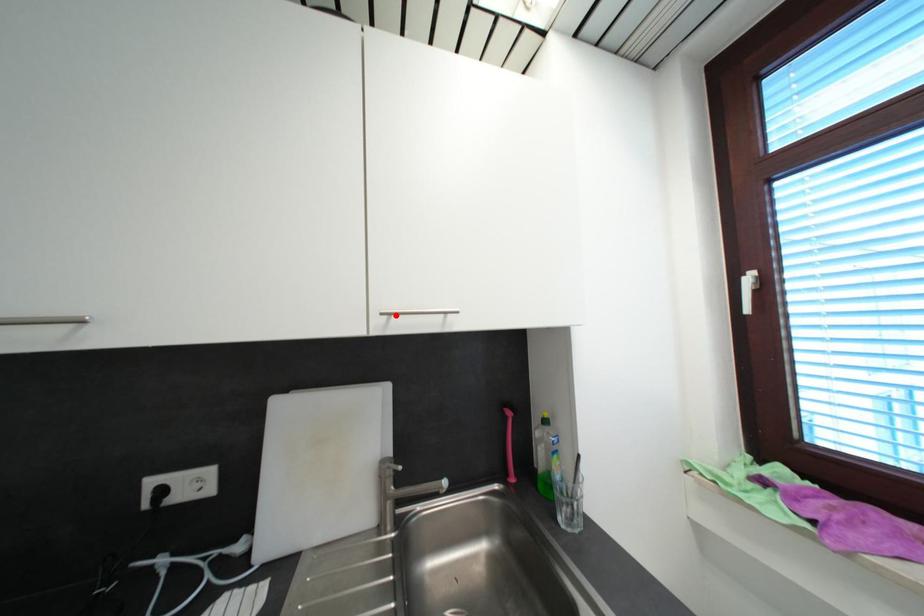
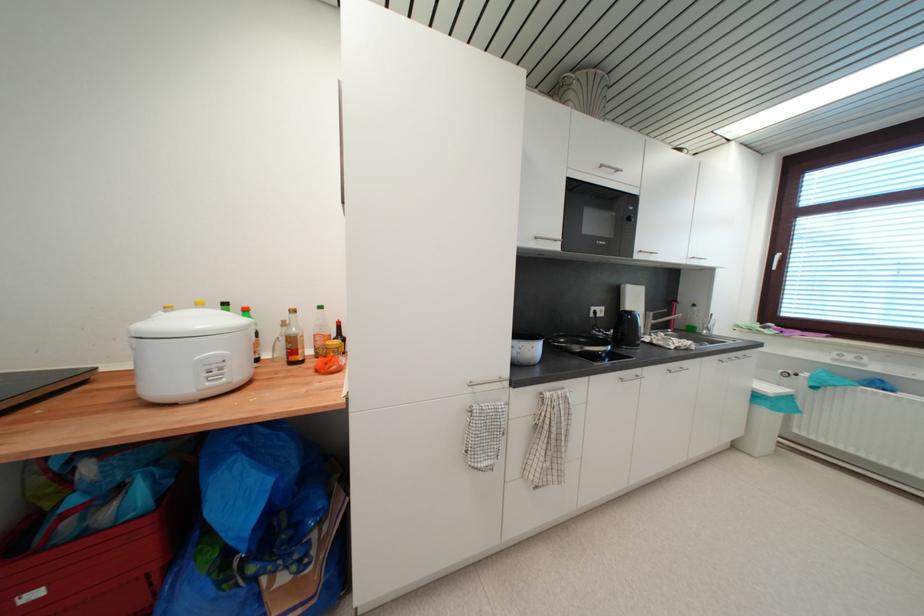
Question: I am providing you with two images of the same scene from different viewpoints. A red point is shown in image1. For the corresponding object point in image2, is it positioned nearer or farther from the camera?

Choices:
 (A) Nearer
 (B) Farther

Answer: (A)